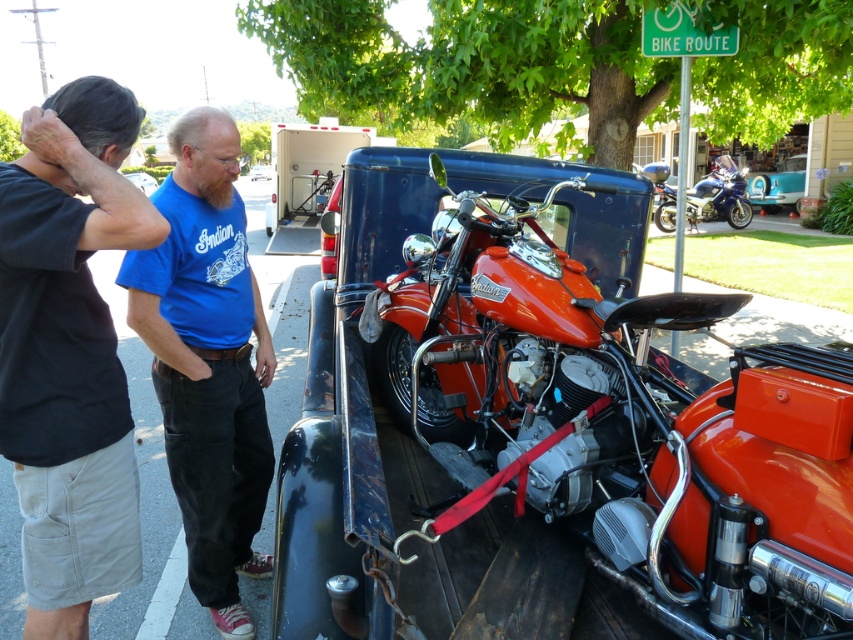
Question: Does shiny orange motorcycle at center appear over black cotton shirt at upper left?

Choices:
 (A) yes
 (B) no

Answer: (A)

Question: Which point appears closest to the camera in this image?

Choices:
 (A) (352, 132)
 (B) (741, 188)

Answer: (A)

Question: Which of the following is the closest to the observer?

Choices:
 (A) blue cotton shirt at center
 (B) shiny metallic motorcycle at upper right

Answer: (A)

Question: Which point appears farthest from the camera in this image?

Choices:
 (A) (270, 168)
 (B) (680, 376)
 (C) (235, 266)
 (D) (151, 192)

Answer: (A)

Question: Can you confirm if shiny metallic motorcycle at upper right is thinner than blue cotton shirt at upper left?

Choices:
 (A) yes
 (B) no

Answer: (A)

Question: Does blue cotton shirt at center appear on the right side of teal glossy car at upper right?

Choices:
 (A) yes
 (B) no

Answer: (B)